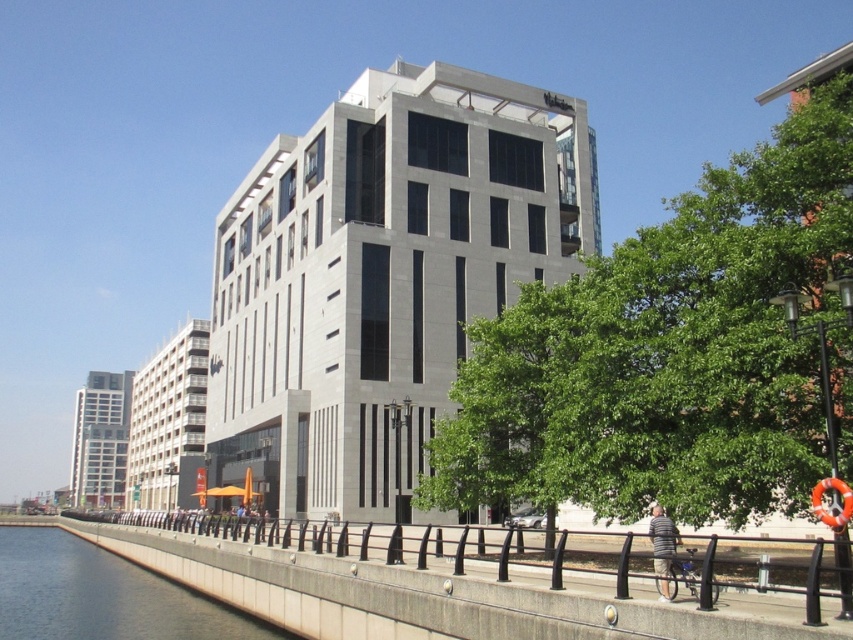
Does gray concrete wall at lower left have a greater height compared to striped cotton shirt at lower right?

Yes, gray concrete wall at lower left is taller than striped cotton shirt at lower right.

Is gray concrete wall at lower left to the right of striped cotton shirt at lower right from the viewer's perspective?

No, gray concrete wall at lower left is not to the right of striped cotton shirt at lower right.

Is point (144, 602) closer to viewer compared to point (662, 508)?

No, it is behind (662, 508).

Find the location of a particular element. This screenshot has width=853, height=640. gray concrete wall at lower left is located at coordinates (102, 595).